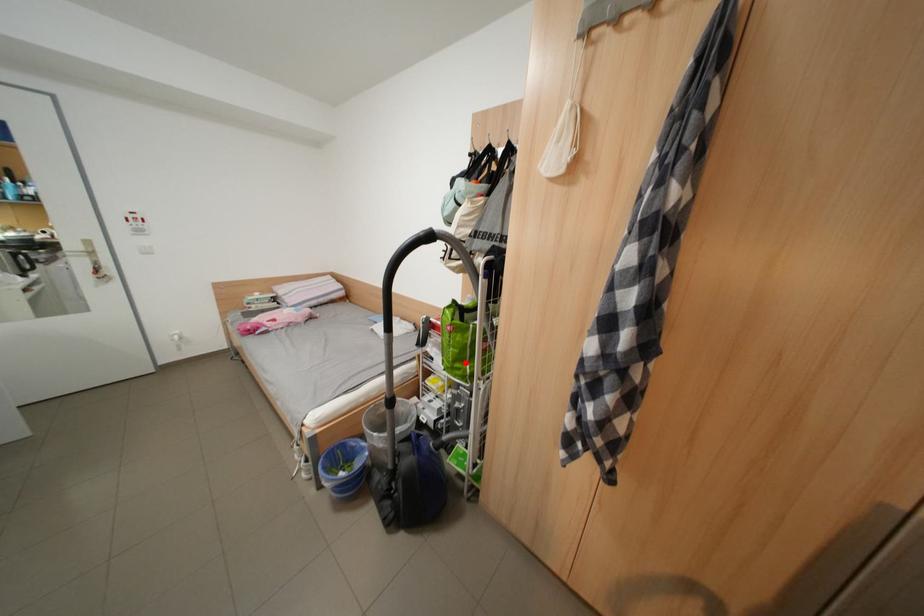
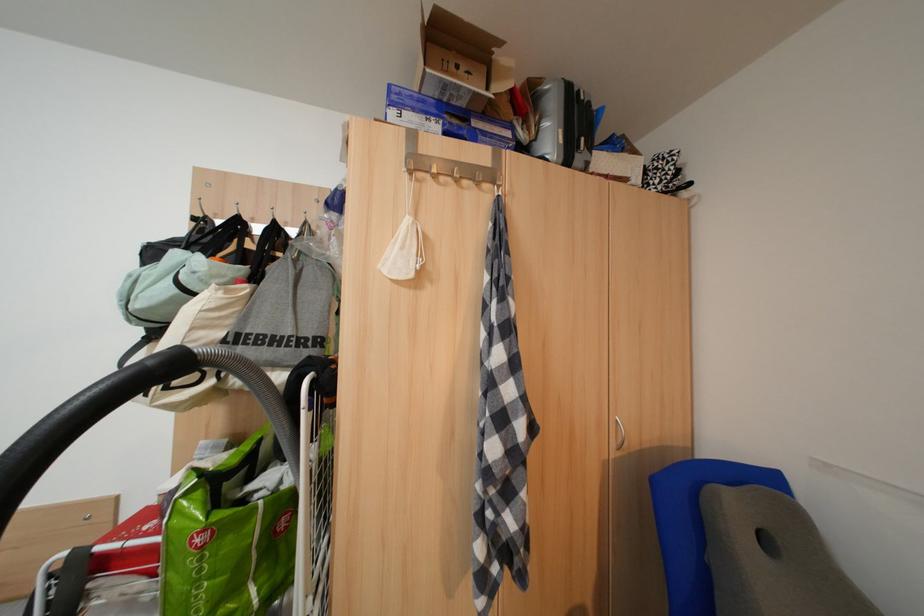
Question: I am providing you with two images of the same scene from different viewpoints. A red point is shown in image1. For the corresponding object point in image2, is it positioned nearer or farther from the camera?

Choices:
 (A) Nearer
 (B) Farther

Answer: (A)